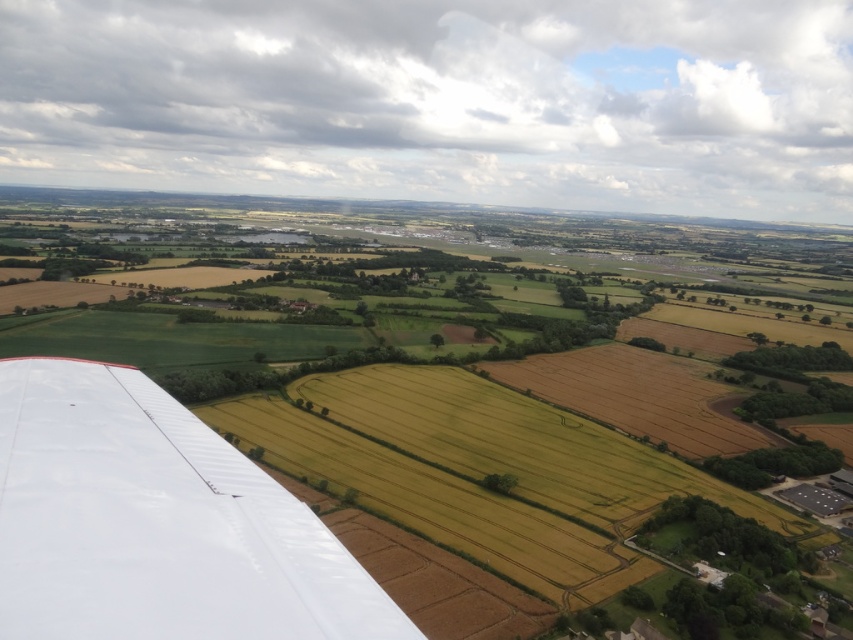
Question: Which of the following is the closest to the observer?

Choices:
 (A) green grassy field at center
 (B) white matte wing at lower left

Answer: (B)

Question: Is green grassy field at center closer to camera compared to white matte wing at lower left?

Choices:
 (A) no
 (B) yes

Answer: (A)

Question: Can you confirm if green grassy field at center is positioned to the left of white matte wing at lower left?

Choices:
 (A) yes
 (B) no

Answer: (B)

Question: Which point appears closest to the camera in this image?

Choices:
 (A) (386, 298)
 (B) (241, 595)

Answer: (B)

Question: In this image, where is green grassy field at center located relative to white matte wing at lower left?

Choices:
 (A) right
 (B) left

Answer: (A)